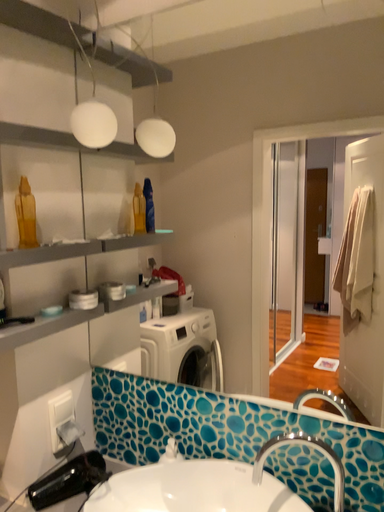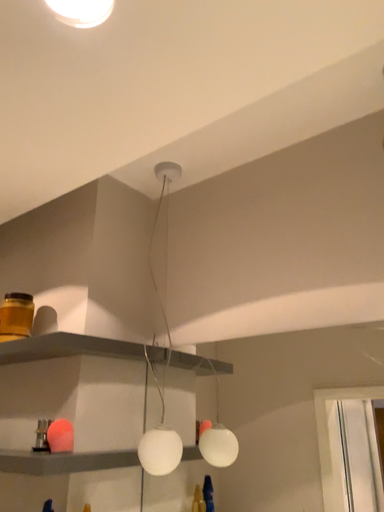
Question: Which way did the camera rotate in the video?

Choices:
 (A) rotated right
 (B) rotated left

Answer: (B)